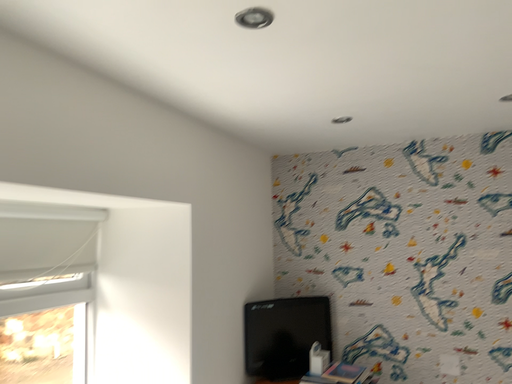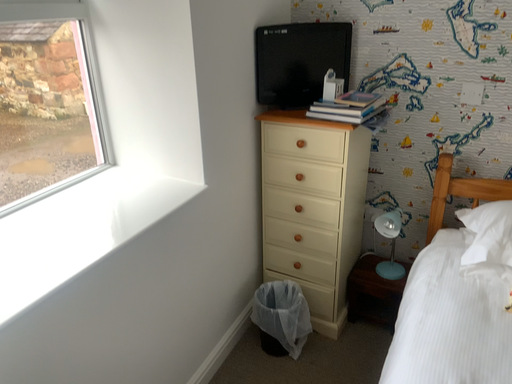
Question: Which way did the camera rotate in the video?

Choices:
 (A) rotated downward
 (B) rotated upward

Answer: (A)